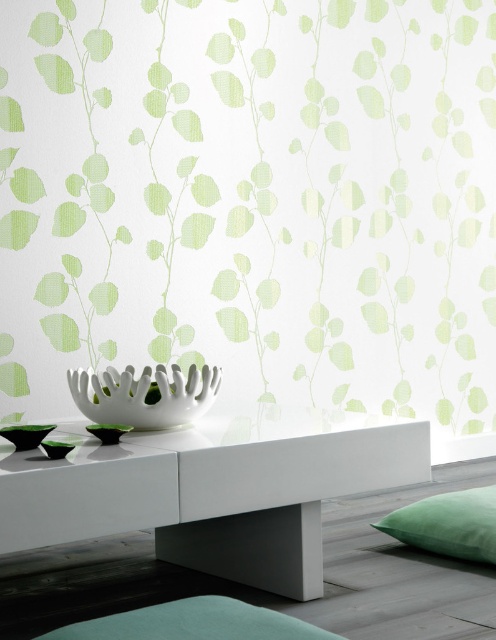
Is green leafy wallpaper at upper center smaller than teal fabric mat at lower center?

No.

Describe the element at coordinates (252, 196) in the screenshot. I see `green leafy wallpaper at upper center` at that location.

I want to click on green leafy wallpaper at upper center, so click(252, 196).

Identify the location of white glossy table at lower center. The width and height of the screenshot is (496, 640). (212, 490).

Is point (229, 566) positioned behind point (477, 534)?

Yes, it is behind point (477, 534).

Find the location of a particular element. The image size is (496, 640). white glossy table at lower center is located at coordinates (212, 490).

Is teal fabric mat at lower center to the right of green velvet cushion at lower right from the viewer's perspective?

In fact, teal fabric mat at lower center is to the left of green velvet cushion at lower right.

Consider the image. How distant is teal fabric mat at lower center from green velvet cushion at lower right?

They are 34.96 inches apart.

I want to click on teal fabric mat at lower center, so click(193, 621).